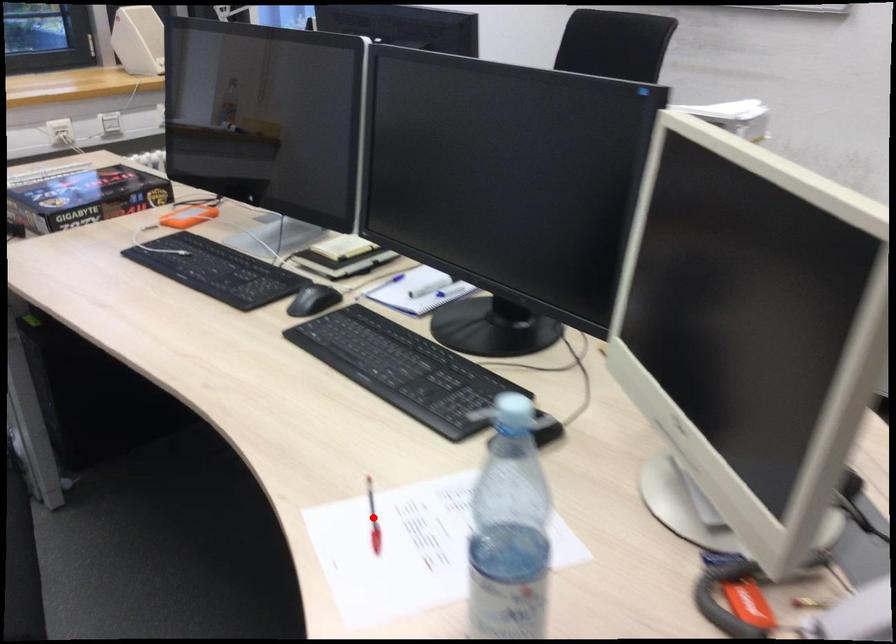
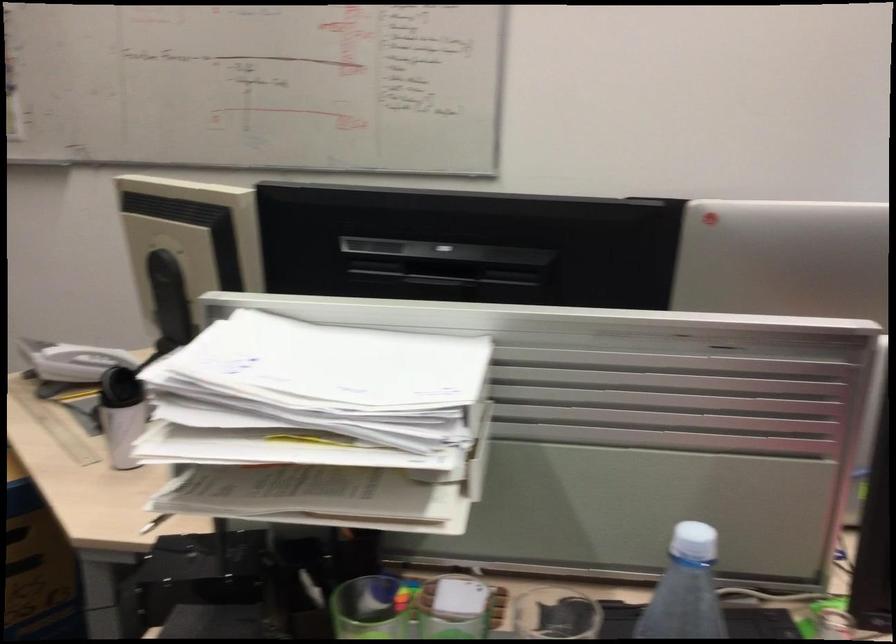
Question: I am providing you with two images of the same scene from different viewpoints. A red point is marked on the first image. Can you still see the location of the red point in image 2?

Choices:
 (A) Yes
 (B) No

Answer: (B)